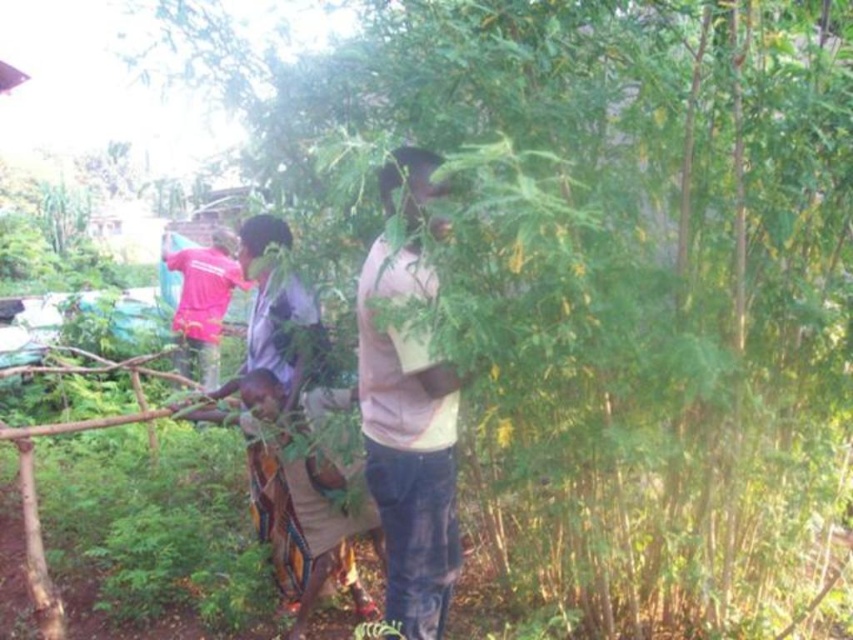
Question: Is pink cotton shirt at center in front of pink fabric at upper left?

Choices:
 (A) yes
 (B) no

Answer: (A)

Question: Among these points, which one is nearest to the camera?

Choices:
 (A) (209, 362)
 (B) (392, 429)

Answer: (B)

Question: Where is pink cotton shirt at center located in relation to pink fabric at upper left in the image?

Choices:
 (A) right
 (B) left

Answer: (A)

Question: Can you confirm if pink cotton shirt at center is wider than pink fabric at upper left?

Choices:
 (A) no
 (B) yes

Answer: (A)

Question: Which object is farther from the camera taking this photo?

Choices:
 (A) pink cotton shirt at center
 (B) pink fabric at upper left

Answer: (B)

Question: Which point is farther to the camera?

Choices:
 (A) (207, 264)
 (B) (430, 531)

Answer: (A)